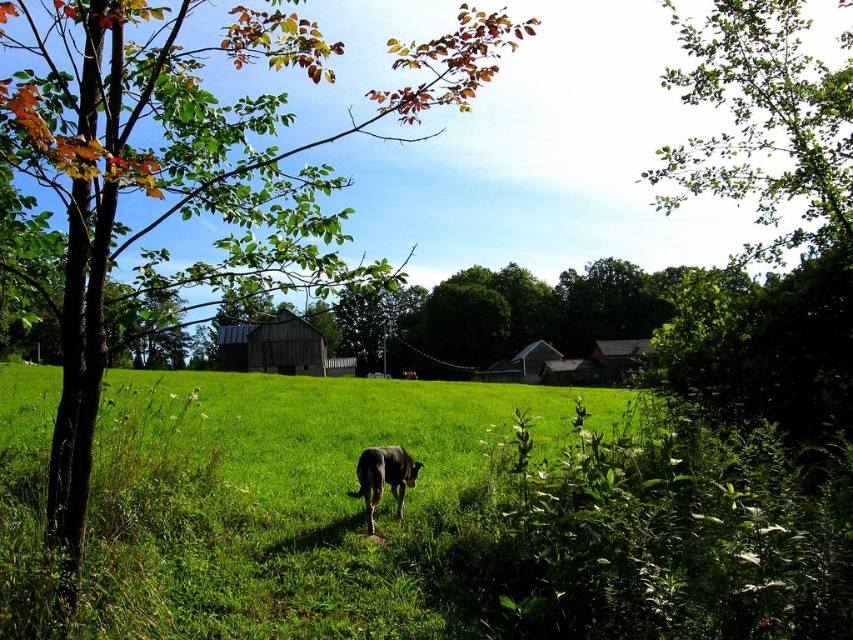
Consider the image. Can you confirm if green leafy tree at upper right is thinner than dark brown wooden barn at center?

No, green leafy tree at upper right is not thinner than dark brown wooden barn at center.

Does point (672, 196) come farther from viewer compared to point (248, 339)?

No, it is in front of (248, 339).

Is point (729, 161) in front of point (293, 368)?

Yes, it is in front of point (293, 368).

Identify the location of green leafy tree at upper right. This screenshot has width=853, height=640. (763, 122).

Describe the element at coordinates (190, 170) in the screenshot. I see `green leafy tree at center` at that location.

Is point (136, 19) closer to camera compared to point (412, 476)?

That is True.

You are a GUI agent. You are given a task and a screenshot of the screen. Output one action in this format:
    pyautogui.click(x=<x>, y=<y>)
    Task: Click on the green leafy tree at center
    
    Given the screenshot: What is the action you would take?
    pyautogui.click(x=190, y=170)

The width and height of the screenshot is (853, 640). Describe the element at coordinates (190, 170) in the screenshot. I see `green leafy tree at center` at that location.

Does green leafy tree at center come behind dark brown wooden barn at center?

No, it is not.

Which is behind, point (62, 353) or point (223, 348)?

The point (223, 348) is more distant.

Where is `green leafy tree at center`? green leafy tree at center is located at coordinates (190, 170).